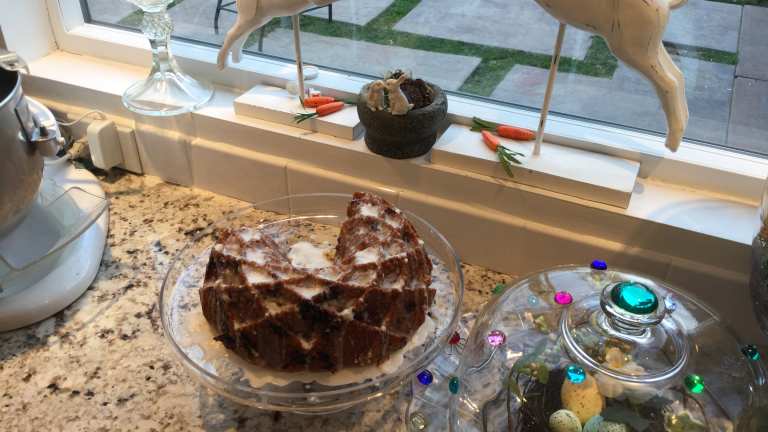
This screenshot has width=768, height=432. Identify the location of window. (720, 61), (435, 39).